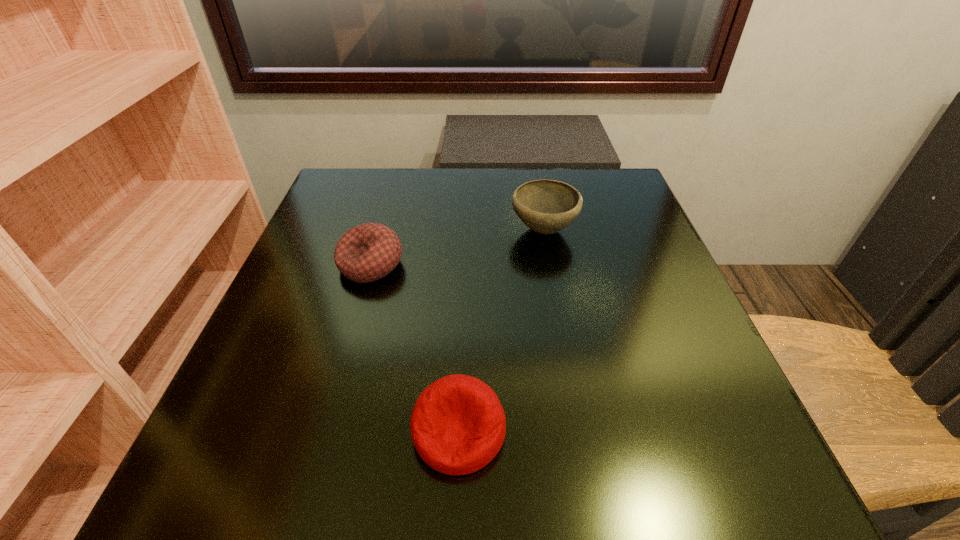
This screenshot has width=960, height=540. In the image, there is a desktop. What are the coordinates of `vacant region at the far edge` in the screenshot? It's located at (499, 211).

Find the location of a particular element. This screenshot has width=960, height=540. vacant point at the near edge is located at coordinates (489, 501).

Locate an element on the screen. Image resolution: width=960 pixels, height=540 pixels. vacant space at the left edge of the desktop is located at coordinates (209, 441).

You are a GUI agent. You are given a task and a screenshot of the screen. Output one action in this format:
    pyautogui.click(x=<x>, y=<y>)
    Task: Click on the vacant space at the right edge
    
    Given the screenshot: What is the action you would take?
    pyautogui.click(x=616, y=301)

Locate an element on the screen. This screenshot has width=960, height=540. vacant space at the far left corner of the desktop is located at coordinates (314, 214).

The width and height of the screenshot is (960, 540). In the image, there is a desktop. What are the coordinates of `free space at the far right corner` in the screenshot? It's located at (615, 211).

This screenshot has width=960, height=540. Identify the location of vacant space that's between the rightmost object and the nearest object. [x=501, y=330].

This screenshot has width=960, height=540. I want to click on vacant point located between the rightmost object and the nearer beanbag, so click(501, 330).

This screenshot has width=960, height=540. What are the coordinates of `free space between the nearest object and the bowl` in the screenshot? It's located at (501, 330).

Identify the location of free space between the left beanbag and the bowl. (457, 247).